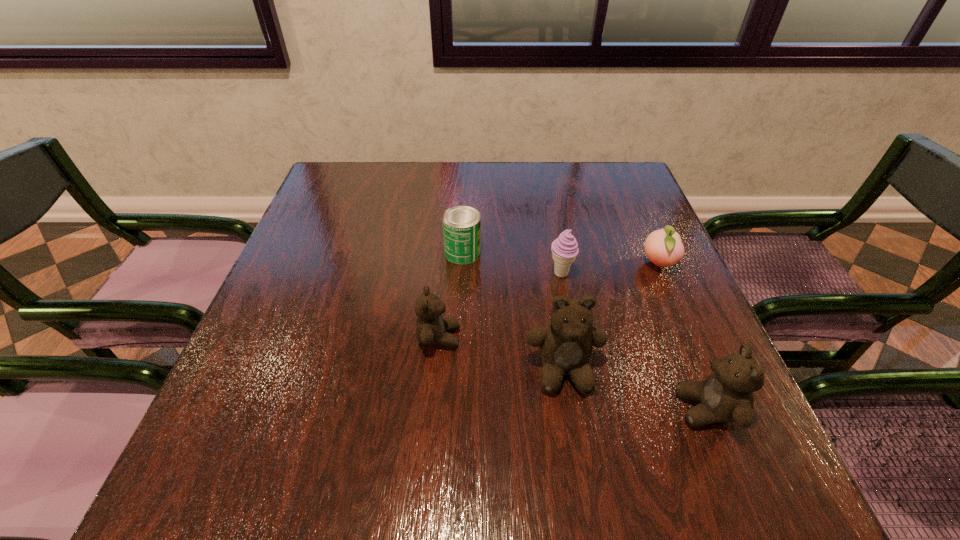
Please point a free position for a teddy bear on the left. Please provide its 2D coordinates. Your answer should be formatted as a tuple, i.e. [(x, y)], where the tuple contains the x and y coordinates of a point satisfying the conditions above.

[(329, 308)]